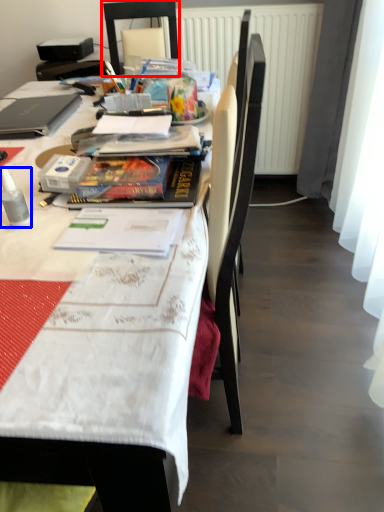
Question: Among these objects, which one is nearest to the camera, chair (highlighted by a red box) or bottle (highlighted by a blue box)?

Choices:
 (A) chair
 (B) bottle

Answer: (B)